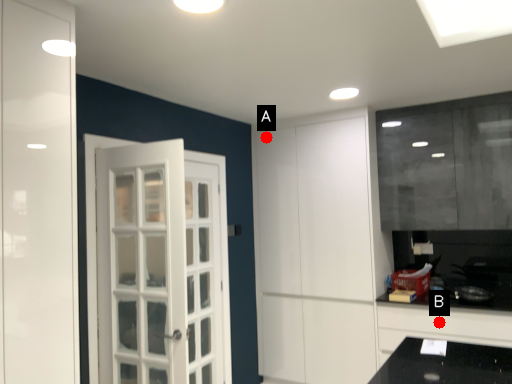
Question: Two points are circled on the image, labeled by A and B beside each circle. Which point is farther to the camera?

Choices:
 (A) A is further
 (B) B is further

Answer: (A)